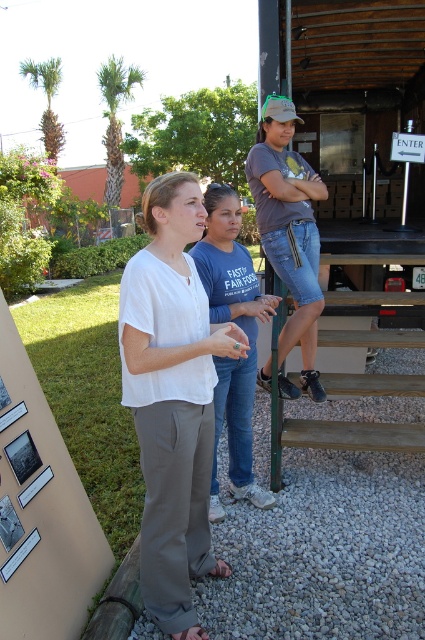
Can you confirm if matte white blouse at center is bigger than blue jeans at center?

Incorrect, matte white blouse at center is not larger than blue jeans at center.

Locate an element on the screen. matte white blouse at center is located at coordinates (172, 397).

What are the coordinates of `matte white blouse at center` in the screenshot? It's located at (172, 397).

Measure the distance between point (149, 419) and camera.

A distance of 6.91 feet exists between point (149, 419) and camera.

Is matte white blouse at center thinner than denim shorts at center?

Yes, matte white blouse at center is thinner than denim shorts at center.

At what (x,y) coordinates should I click in order to perform the action: click on matte white blouse at center. Please return your answer as a coordinate pair (x, y). Image resolution: width=425 pixels, height=640 pixels. Looking at the image, I should click on (172, 397).

Is denim shorts at center closer to camera compared to brown wooden stairs at center?

Yes, denim shorts at center is closer to the viewer.

Which is behind, point (268, 160) or point (407, 435)?

The point (407, 435) is behind.

Does point (305, 305) come in front of point (356, 432)?

Yes, it is.

In order to click on denim shorts at center in this screenshot , I will do [x=289, y=227].